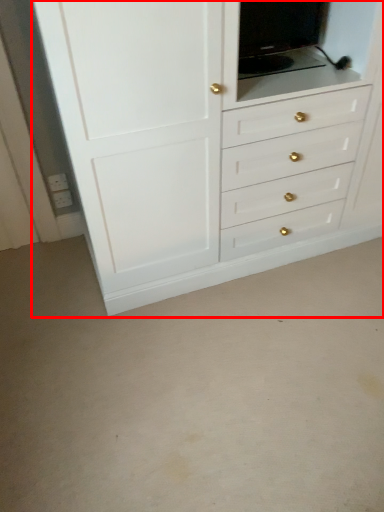
Question: From the image's perspective, where is chest of drawers (annotated by the red box) located in relation to medicine cabinet in the image?

Choices:
 (A) below
 (B) above

Answer: (A)